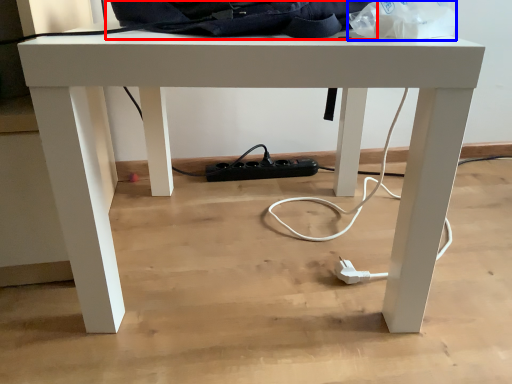
Question: Which of the following is the closest to the observer, messenger bag (highlighted by a red box) or paper bag (highlighted by a blue box)?

Choices:
 (A) messenger bag
 (B) paper bag

Answer: (B)